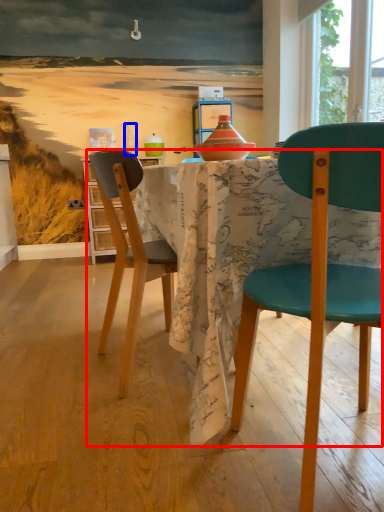
Question: Which object is further to the camera taking this photo, kitchen & dining room table (highlighted by a red box) or bottle (highlighted by a blue box)?

Choices:
 (A) kitchen & dining room table
 (B) bottle

Answer: (B)